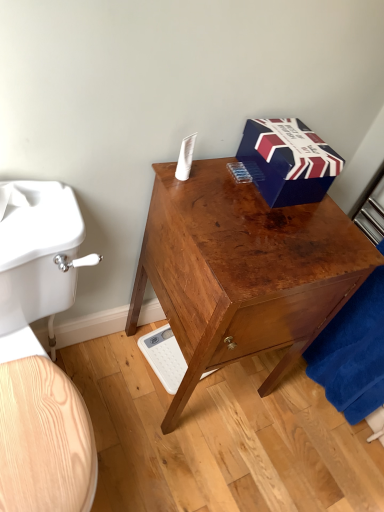
Locate an element on the screen. The height and width of the screenshot is (512, 384). empty space that is in between blue cardboard box at upper right and white matte toilet paper at upper center is located at coordinates (228, 180).